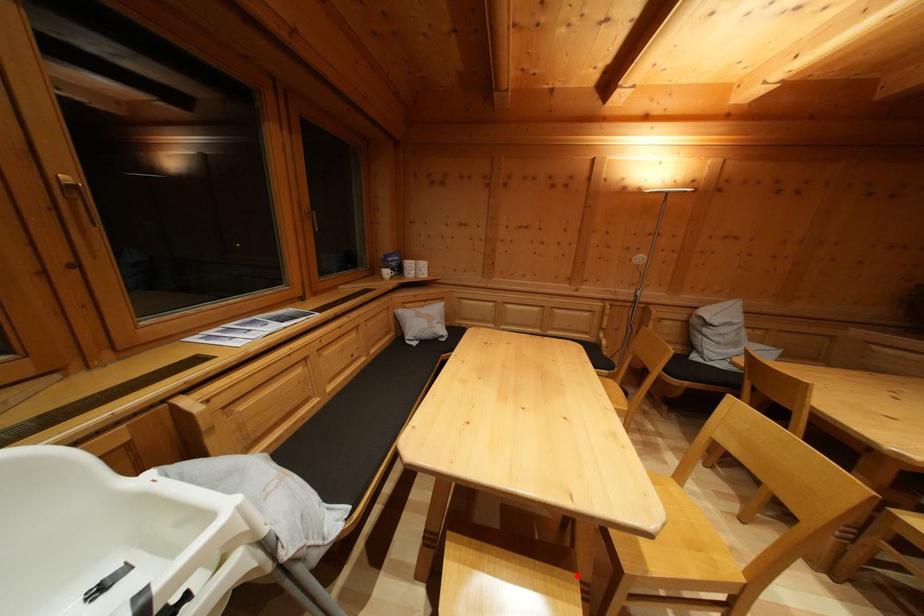
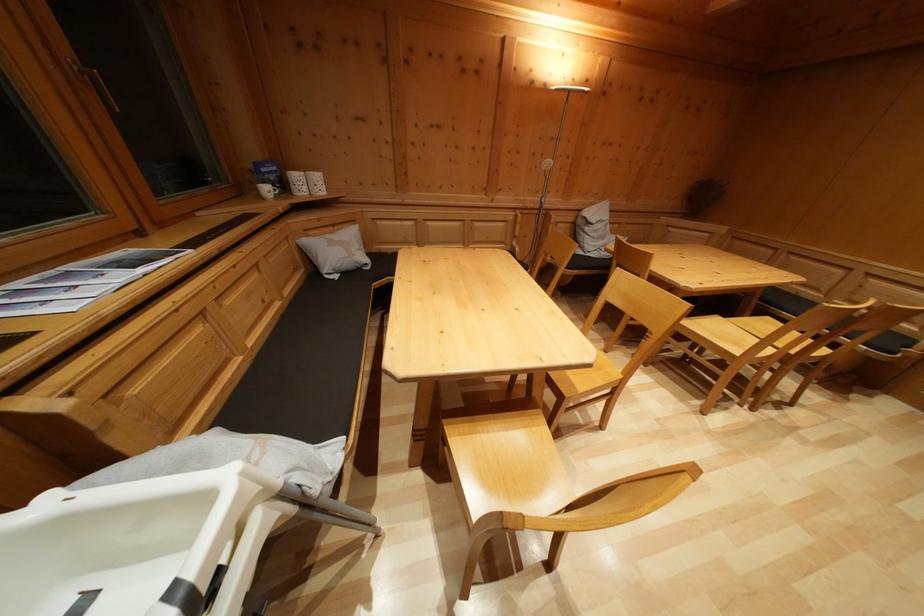
Question: I am providing you with two images of the same scene from different viewpoints. Image1 has a red point marked. In image2, the corresponding 3D location appears at what relative position? Reply with the corresponding letter.

Choices:
 (A) Closer
 (B) Farther

Answer: (A)